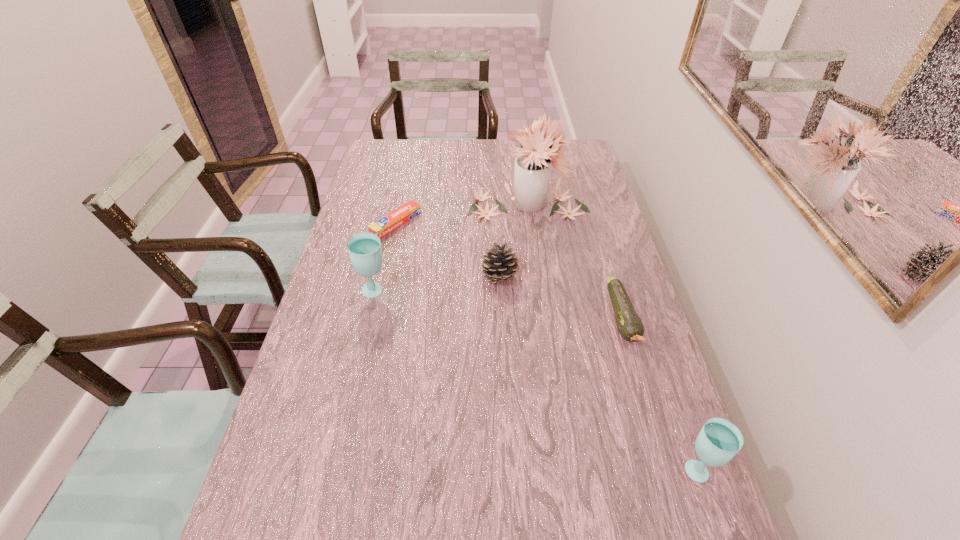
This screenshot has width=960, height=540. In order to click on free spot between the fourth shortest object and the fifth shortest object in this screenshot , I will do `click(536, 380)`.

Locate an element on the screen. This screenshot has width=960, height=540. vacant point located between the zucchini and the farther glass is located at coordinates [498, 305].

Identify the location of empty space between the pinecone and the tallest object. (514, 240).

This screenshot has width=960, height=540. I want to click on the fourth closest object to the right glass, so click(x=364, y=249).

What are the coordinates of `object that is the third closest to the fourth tallest object` in the screenshot? It's located at (629, 324).

Identify the location of free location that satisfies the following two spatial constraints: 1. at the blossom end of the fourth shortest object; 2. on the left side of the second shortest object. Image resolution: width=960 pixels, height=540 pixels. (666, 468).

This screenshot has width=960, height=540. I want to click on free space that satisfies the following two spatial constraints: 1. on the back side of the fifth shortest object; 2. on the right side of the tallest object, so click(x=395, y=205).